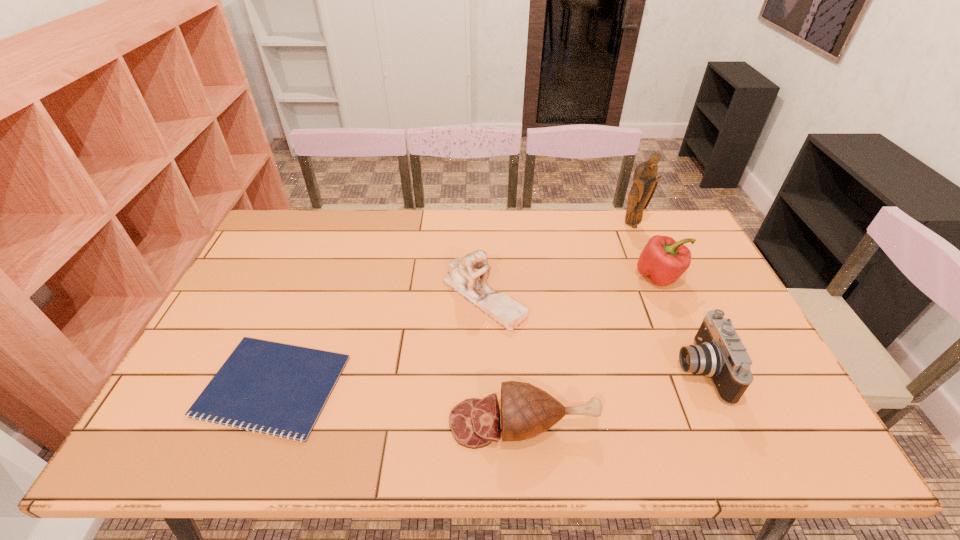
Locate an element on the screen. the right figurine is located at coordinates (x=645, y=182).

Where is `the farther figurine`? This screenshot has height=540, width=960. the farther figurine is located at coordinates (645, 182).

At what (x,y) coordinates should I click in order to perform the action: click on the shorter figurine. Please return your answer as a coordinate pair (x, y). The height and width of the screenshot is (540, 960). Looking at the image, I should click on (463, 277).

Identify the location of the nearer figurine. The height and width of the screenshot is (540, 960). (463, 277).

Where is `bell pepper`? bell pepper is located at coordinates (663, 260).

The image size is (960, 540). In order to click on camera in this screenshot , I will do `click(718, 353)`.

You are a GUI agent. You are given a task and a screenshot of the screen. Output one action in this format:
    pyautogui.click(x=<x>, y=<y>)
    Task: Click on the second shortest object
    The height and width of the screenshot is (540, 960).
    Given the screenshot: What is the action you would take?
    pyautogui.click(x=527, y=411)

You are a GUI agent. You are given a task and a screenshot of the screen. Output one action in this format:
    pyautogui.click(x=<x>, y=<y>)
    Task: Click on the notepad
    The width and height of the screenshot is (960, 540).
    Given the screenshot: What is the action you would take?
    pyautogui.click(x=276, y=386)

Find the location of a particular element. This screenshot has height=540, width=960. the shortest object is located at coordinates (276, 386).

Find the location of a particular element. This screenshot has width=960, height=540. vacant region located on the front-facing side of the farther figurine is located at coordinates (642, 249).